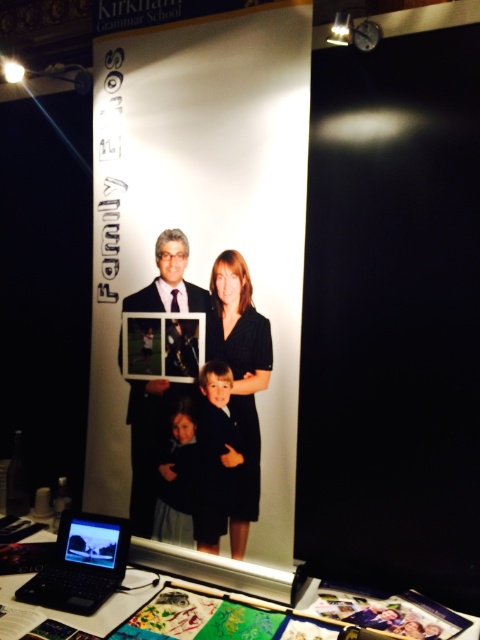
Question: Among these objects, which one is farthest from the camera?

Choices:
 (A) black matte dress at center
 (B) matte black suit at center
 (C) silver metallic laptop at lower left
 (D) metallic photo frame at center

Answer: (D)

Question: Is black matte dress at center thinner than silver metallic laptop at lower left?

Choices:
 (A) yes
 (B) no

Answer: (A)

Question: Which is farther from the black matte dress at center?

Choices:
 (A) matte black suit at center
 (B) silver metallic laptop at lower left
 (C) metallic photo frame at center

Answer: (B)

Question: Considering the relative positions of matte black suit at center and metallic photo frame at center in the image provided, where is matte black suit at center located with respect to metallic photo frame at center?

Choices:
 (A) above
 (B) below

Answer: (B)

Question: Is the position of matte black suit at center more distant than that of metallic photo frame at center?

Choices:
 (A) no
 (B) yes

Answer: (A)

Question: Among these points, which one is nearest to the camera?

Choices:
 (A) (80, 600)
 (B) (245, 392)
 (C) (179, 339)
 (D) (162, 397)

Answer: (A)